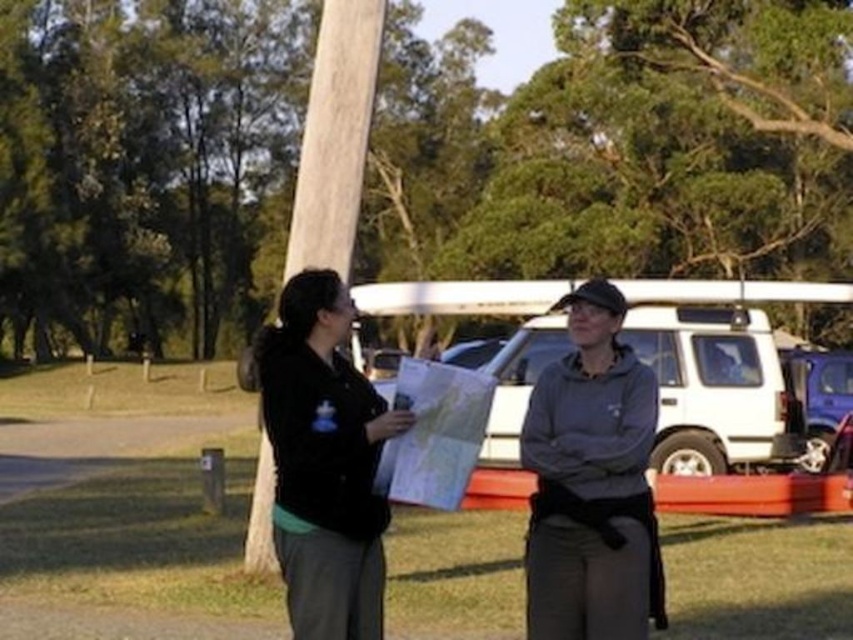
Question: Is brushed metal pole at center positioned at the back of white matte suv at center?

Choices:
 (A) no
 (B) yes

Answer: (A)

Question: Which of the following is the closest to the observer?

Choices:
 (A) gray fleece jacket at center
 (B) brushed metal pole at center

Answer: (A)

Question: Is gray fleece jacket at center closer to camera compared to white matte suv at center?

Choices:
 (A) no
 (B) yes

Answer: (B)

Question: Which object is closer to the camera taking this photo?

Choices:
 (A) black matte jacket at center
 (B) gray fleece jacket at center
 (C) white matte suv at center
 (D) brushed metal pole at center

Answer: (A)

Question: Which point is farther from the camera taking this photo?

Choices:
 (A) (297, 621)
 (B) (630, 506)

Answer: (B)

Question: Does brushed metal pole at center have a lesser width compared to smooth wooden pole at center?

Choices:
 (A) yes
 (B) no

Answer: (B)